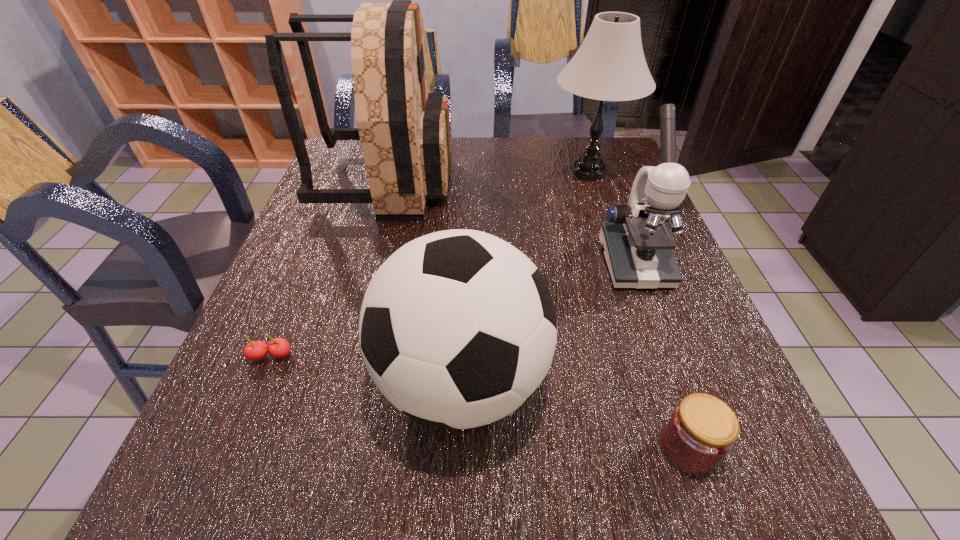
I want to click on vacant space located 0.050m on the front of the jam, so click(x=711, y=514).

This screenshot has height=540, width=960. What are the coordinates of `vacant position located 0.190m on the back of the shortest object` in the screenshot? It's located at (304, 276).

The image size is (960, 540). What are the coordinates of `backpack that is at the far edge` in the screenshot? It's located at (404, 130).

Where is `lamp present at the far edge`? The width and height of the screenshot is (960, 540). lamp present at the far edge is located at coordinates (610, 65).

You are a GUI agent. You are given a task and a screenshot of the screen. Output one action in this format:
    pyautogui.click(x=<x>, y=<y>)
    Task: Click on the soccer ball present at the near edge
    
    Given the screenshot: What is the action you would take?
    pyautogui.click(x=458, y=328)

Find the location of a particular element. jam situated at the near edge is located at coordinates (701, 431).

Image resolution: width=960 pixels, height=540 pixels. What are the coordinates of `backpack positioned at the left edge` in the screenshot? It's located at (404, 130).

You are a GUI agent. You are given a task and a screenshot of the screen. Output one action in this format:
    pyautogui.click(x=<x>, y=<y>)
    Task: Click on the cherry present at the left edge
    The height and width of the screenshot is (540, 960).
    Given the screenshot: What is the action you would take?
    pos(279,347)

What are the coordinates of `lamp present at the right edge` in the screenshot? It's located at (610, 65).

Locate an element on the screen. microscope that is at the right edge is located at coordinates (637, 244).